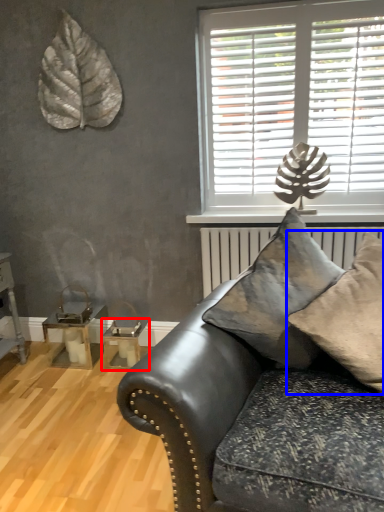
Question: Which point is further to the camera, table (highlighted by a red box) or pillow (highlighted by a blue box)?

Choices:
 (A) table
 (B) pillow

Answer: (A)